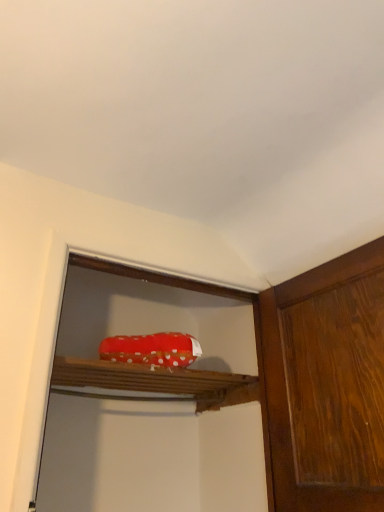
Question: Is red polka dot fabric at center spatially inside wooden cabinet at center, or outside of it?

Choices:
 (A) inside
 (B) outside

Answer: (B)

Question: In terms of height, does red polka dot fabric at center look taller or shorter compared to wooden cabinet at center?

Choices:
 (A) tall
 (B) short

Answer: (B)

Question: Is red polka dot fabric at center to the left or to the right of wooden cabinet at center in the image?

Choices:
 (A) right
 (B) left

Answer: (A)

Question: Considering the positions of wooden cabinet at center and red polka dot fabric at center in the image, is wooden cabinet at center taller or shorter than red polka dot fabric at center?

Choices:
 (A) short
 (B) tall

Answer: (B)

Question: In the image, is wooden cabinet at center on the left side or the right side of red polka dot fabric at center?

Choices:
 (A) left
 (B) right

Answer: (A)

Question: From a real-world perspective, relative to red polka dot fabric at center, is wooden cabinet at center vertically above or below?

Choices:
 (A) below
 (B) above

Answer: (A)

Question: Looking at their shapes, would you say wooden cabinet at center is wider or thinner than red polka dot fabric at center?

Choices:
 (A) thin
 (B) wide

Answer: (B)